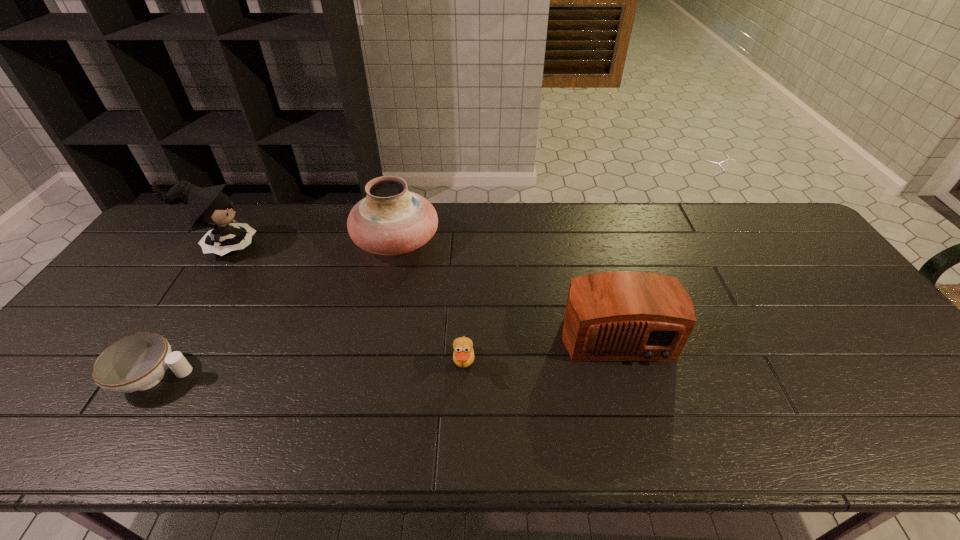
In the image, there is a desktop. Where is `vacant space at the far right corner`? The image size is (960, 540). vacant space at the far right corner is located at coordinates (763, 224).

This screenshot has height=540, width=960. I want to click on unoccupied area between the doll and the shortest object, so click(189, 313).

Identify the location of vacant space in between the radio receiver and the duck. (540, 348).

In order to click on free point between the fourth shortest object and the third tallest object in this screenshot , I will do `click(506, 286)`.

You are a GUI agent. You are given a task and a screenshot of the screen. Output one action in this format:
    pyautogui.click(x=<x>, y=<y>)
    Task: Click on the vacant point located between the second tallest object and the duck
    
    Given the screenshot: What is the action you would take?
    pos(430,304)

Where is `free space between the doll and the pottery`? This screenshot has height=540, width=960. free space between the doll and the pottery is located at coordinates (309, 245).

The height and width of the screenshot is (540, 960). Find the location of `free spot between the rightmost object and the doll`. free spot between the rightmost object and the doll is located at coordinates (419, 289).

This screenshot has height=540, width=960. What are the coordinates of `free space between the chinaware and the third shortest object` in the screenshot? It's located at (386, 354).

Locate an element on the screen. This screenshot has width=960, height=540. unoccupied position between the chinaware and the second tallest object is located at coordinates (276, 310).

This screenshot has height=540, width=960. Find the location of `free space between the radio receiver and the fourth tallest object`. free space between the radio receiver and the fourth tallest object is located at coordinates (540, 348).